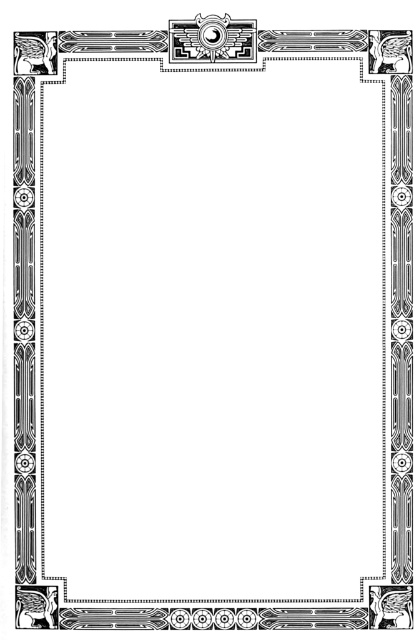
You are an art student analyzing the symmetry of the frame. You notice two elements, the matte black square at bottom right and the matte black circle at upper center. Which of these two elements is positioned to the right of the other?

The matte black square at bottom right is positioned to the right of the matte black circle at upper center.

You are an art conservator examining the Art Deco frame. You need to place a protective sticker precisely at the bottom right corner of the frame. According to the coordinates provided, where should you position the sticker relative to the matte black square at bottom right?

The matte black square at bottom right is located at point (390, 605), so you should position the sticker exactly at that coordinate to place it precisely at the bottom right corner of the frame.

You are an art conservator examining the frame. You notice a specific point at coordinates (390, 605). What object is located at this position?

The point at coordinates (390, 605) corresponds to the matte black square at bottom right.